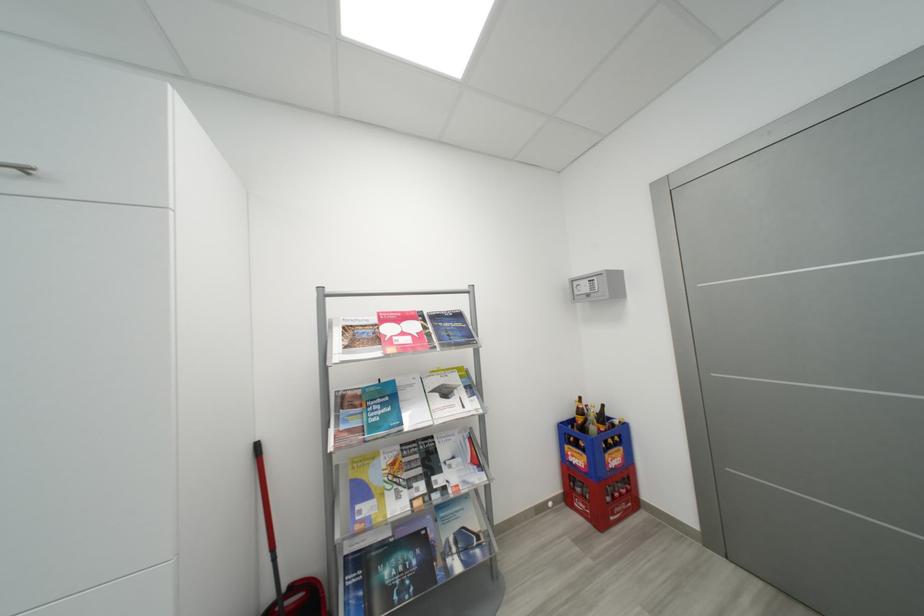
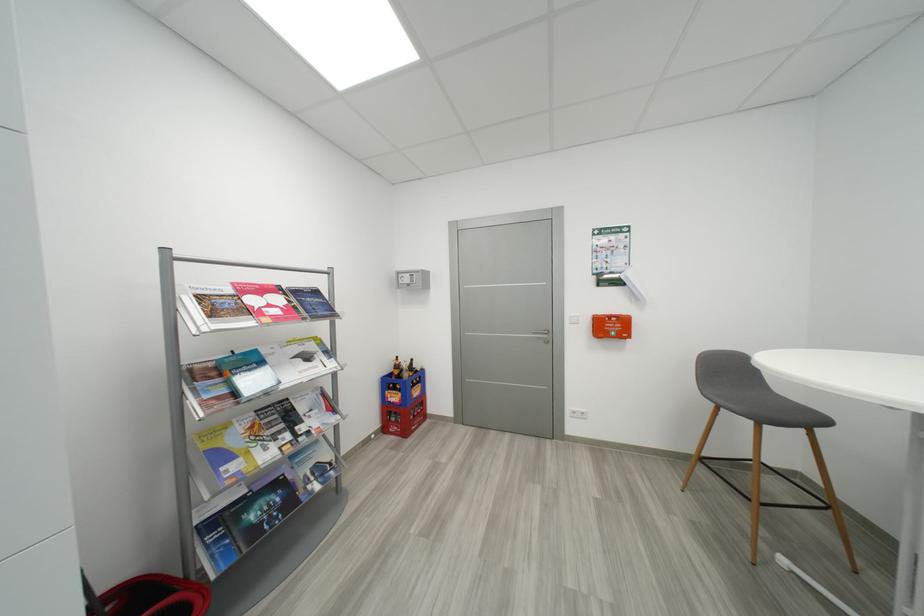
The point at (429, 488) is marked in the first image. Where is the corresponding point in the second image?

(294, 438)